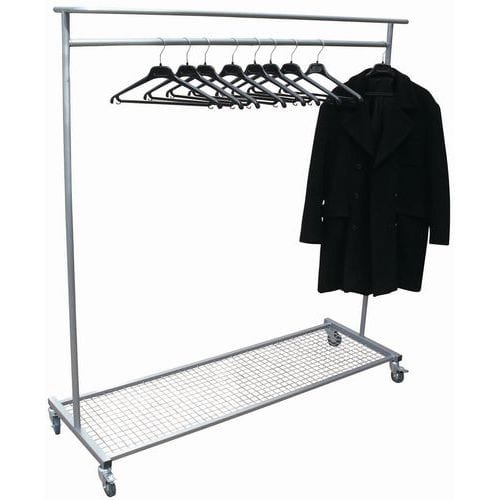
This screenshot has width=500, height=500. What are the coordinates of `cought hangers on a laundry rack` in the screenshot? It's located at (169, 73), (184, 68), (203, 70), (224, 65), (255, 70), (276, 68), (296, 69), (314, 66), (384, 69).